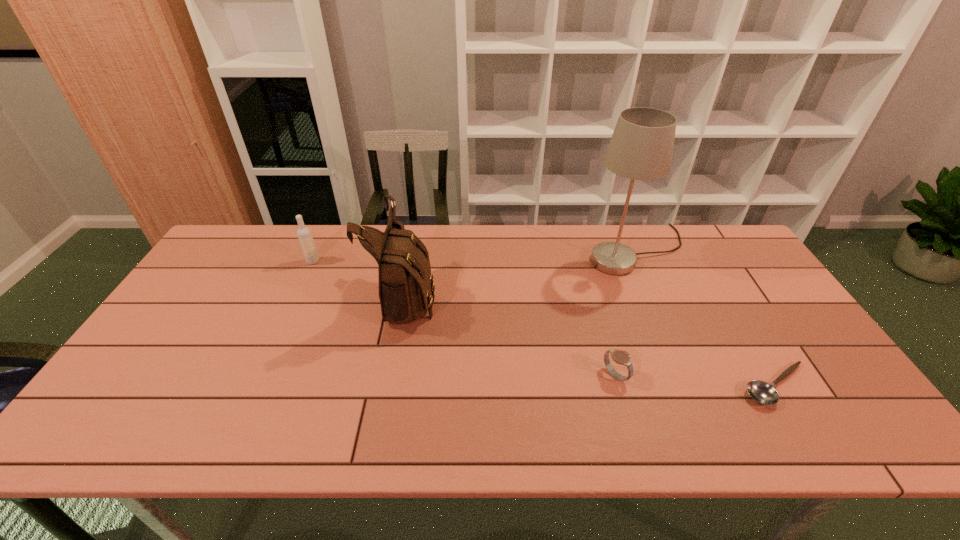
The image size is (960, 540). Identify the location of vacant space located 0.060m on the left of the watch. [579, 375].

Where is `vacant space located 0.090m on the back of the ladle`? vacant space located 0.090m on the back of the ladle is located at coordinates (747, 337).

You are a GUI agent. You are given a task and a screenshot of the screen. Output one action in this format:
    pyautogui.click(x=<x>, y=<y>)
    Task: Click on the table lamp that is at the far edge
    The width and height of the screenshot is (960, 540).
    Given the screenshot: What is the action you would take?
    pyautogui.click(x=641, y=148)

At what (x,y) coordinates should I click in order to perform the action: click on shoulder bag that is at the far edge. Please return your answer as a coordinate pair (x, y). The height and width of the screenshot is (540, 960). Looking at the image, I should click on (406, 284).

At what (x,y) coordinates should I click in order to perform the action: click on vodka present at the far edge. Please return your answer as a coordinate pair (x, y). This screenshot has width=960, height=540. Looking at the image, I should click on (304, 234).

Identify the location of object that is positioned at the right edge. (762, 392).

Where is `vacant space at the far edge of the desktop`? Image resolution: width=960 pixels, height=540 pixels. vacant space at the far edge of the desktop is located at coordinates click(534, 237).

Image resolution: width=960 pixels, height=540 pixels. What are the coordinates of `vacant point at the near edge` in the screenshot? It's located at (693, 417).

You are a GUI agent. You are given a task and a screenshot of the screen. Output one action in this format:
    pyautogui.click(x=<x>, y=<y>)
    Task: Click on the vacant space at the left edge
    
    Given the screenshot: What is the action you would take?
    pyautogui.click(x=198, y=285)

In the image, there is a desktop. Identify the location of vacant space at the right edge. The height and width of the screenshot is (540, 960). (795, 392).